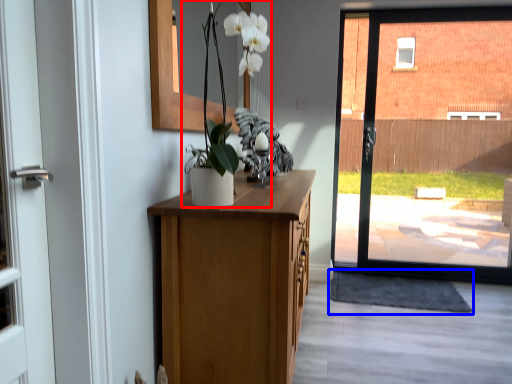
Question: Among these objects, which one is farthest to the camera, floral arrangement (highlighted by a red box) or doormat (highlighted by a blue box)?

Choices:
 (A) floral arrangement
 (B) doormat

Answer: (B)